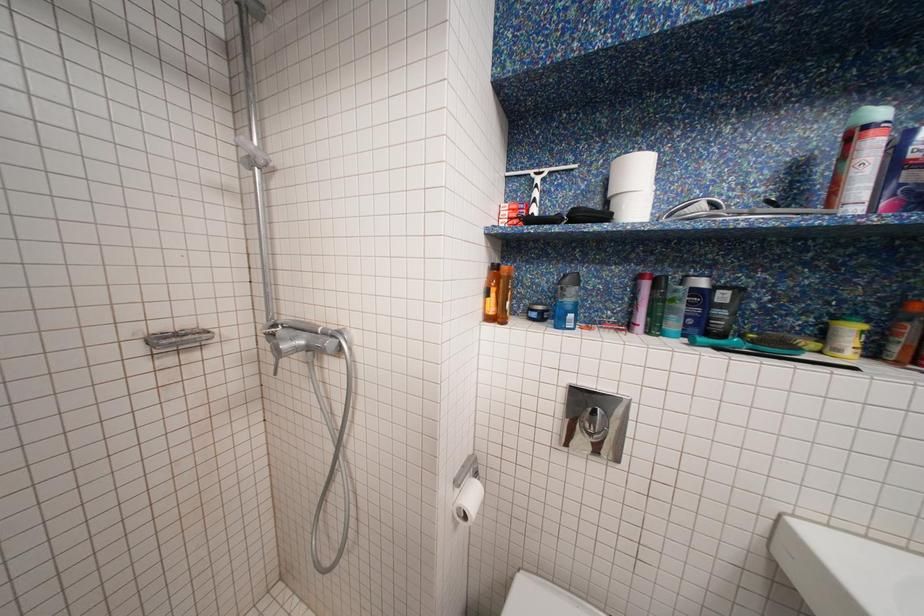
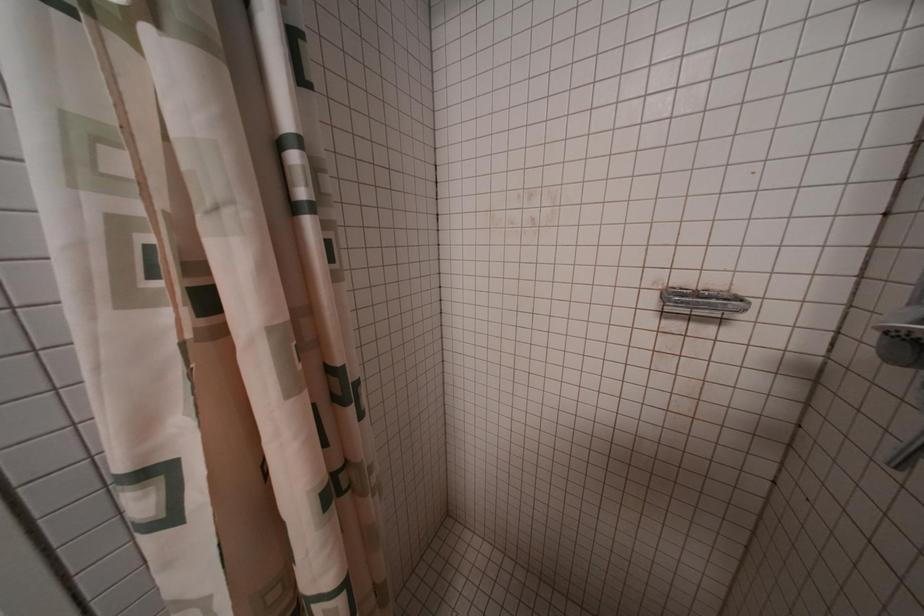
Question: Based on the continuous images, in which direction is the camera rotating? Reply with the corresponding letter.

Choices:
 (A) Left
 (B) Right
 (C) Up
 (D) Down

Answer: (A)